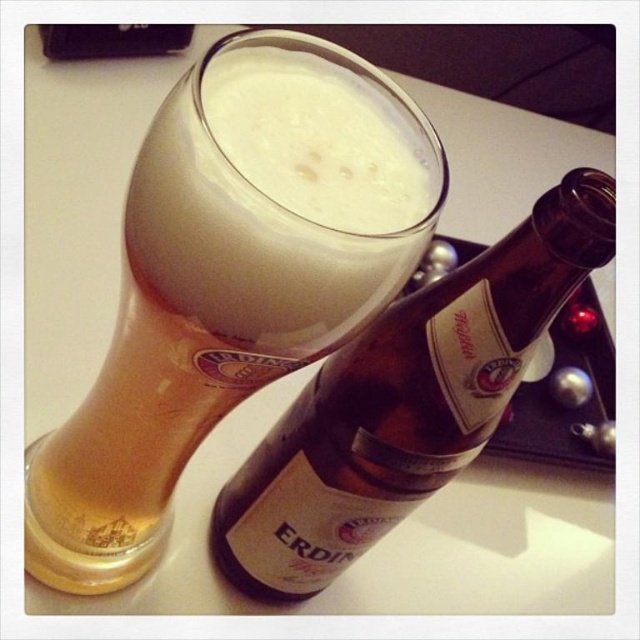
Is golden glass beer at center taller than brown glass bottle at upper center?

Correct, golden glass beer at center is much taller as brown glass bottle at upper center.

Is golden glass beer at center shorter than brown glass bottle at upper center?

In fact, golden glass beer at center may be taller than brown glass bottle at upper center.

What are the coordinates of `golden glass beer at center` in the screenshot? It's located at (202, 324).

Locate an element on the screen. Image resolution: width=640 pixels, height=640 pixels. golden glass beer at center is located at coordinates (202, 324).

Can you confirm if golden glass beer at center is smaller than foamy white beer at upper center?

Incorrect, golden glass beer at center is not smaller in size than foamy white beer at upper center.

Who is shorter, golden glass beer at center or foamy white beer at upper center?

foamy white beer at upper center

Identify the location of golden glass beer at center. This screenshot has height=640, width=640. (202, 324).

Is brown glass bottle at upper center shorter than foamy white beer at upper center?

No.

How much distance is there between brown glass bottle at upper center and foamy white beer at upper center?

They are 13.51 centimeters apart.

At what (x,y) coordinates should I click in order to perform the action: click on brown glass bottle at upper center. Please return your answer as a coordinate pair (x, y). The width and height of the screenshot is (640, 640). Looking at the image, I should click on pos(406,401).

The width and height of the screenshot is (640, 640). Find the location of `brown glass bottle at upper center`. brown glass bottle at upper center is located at coordinates click(x=406, y=401).